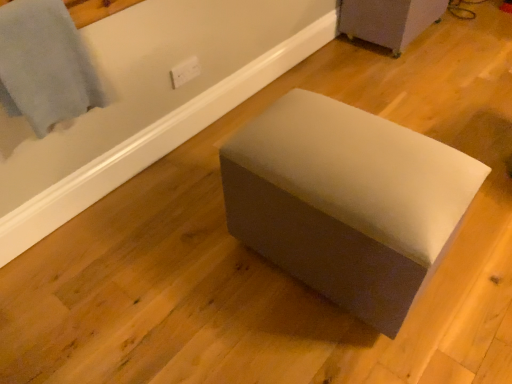
Question: Is matte gray ottoman at center, marked as the second furniture in a left-to-right arrangement, thinner than suede-like gray ottoman at center, which appears as the first furniture when viewed from the left?

Choices:
 (A) no
 (B) yes

Answer: (B)

Question: Does matte gray ottoman at center, which ranks as the first furniture in top-to-bottom order, come in front of suede-like gray ottoman at center, the 1th furniture positioned from the bottom?

Choices:
 (A) yes
 (B) no

Answer: (B)

Question: Does matte gray ottoman at center, the 2th furniture from the bottom, have a greater width compared to suede-like gray ottoman at center, placed as the second furniture when sorted from top to bottom?

Choices:
 (A) yes
 (B) no

Answer: (B)

Question: Is matte gray ottoman at center, the 2th furniture from the bottom, bigger than suede-like gray ottoman at center, the 2th furniture positioned from the back?

Choices:
 (A) no
 (B) yes

Answer: (A)

Question: Is matte gray ottoman at center, the first furniture positioned from the right, touching suede-like gray ottoman at center, which appears as the first furniture when viewed from the left?

Choices:
 (A) yes
 (B) no

Answer: (B)

Question: Considering the relative sizes of matte gray ottoman at center, the 2th furniture positioned from the front, and suede-like gray ottoman at center, the 1th furniture positioned from the bottom, in the image provided, is matte gray ottoman at center, the 2th furniture positioned from the front, taller than suede-like gray ottoman at center, the 1th furniture positioned from the bottom,?

Choices:
 (A) yes
 (B) no

Answer: (B)

Question: Does matte gray ottoman at center, the 2th furniture from the bottom, have a greater height compared to light blue fabric at upper left?

Choices:
 (A) yes
 (B) no

Answer: (B)

Question: Could light blue fabric at upper left be considered to be inside matte gray ottoman at center, which is counted as the first furniture, starting from the back?

Choices:
 (A) no
 (B) yes

Answer: (A)

Question: From the image's perspective, does matte gray ottoman at center, which ranks as the first furniture in top-to-bottom order, appear lower than light blue fabric at upper left?

Choices:
 (A) yes
 (B) no

Answer: (B)

Question: Is matte gray ottoman at center, which ranks as the first furniture in top-to-bottom order, facing towards light blue fabric at upper left?

Choices:
 (A) yes
 (B) no

Answer: (B)

Question: From a real-world perspective, is matte gray ottoman at center, which is counted as the first furniture, starting from the back, on light blue fabric at upper left?

Choices:
 (A) yes
 (B) no

Answer: (B)

Question: Is matte gray ottoman at center, which ranks as the first furniture in top-to-bottom order, turned away from light blue fabric at upper left?

Choices:
 (A) no
 (B) yes

Answer: (A)

Question: Considering the relative positions of light blue fabric at upper left and suede-like gray ottoman at center, arranged as the second furniture when viewed from the right, in the image provided, is light blue fabric at upper left to the right of suede-like gray ottoman at center, arranged as the second furniture when viewed from the right, from the viewer's perspective?

Choices:
 (A) no
 (B) yes

Answer: (A)